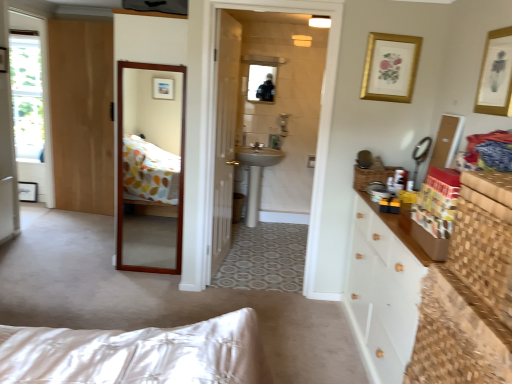
Locate an element on the screen. unoccupied area in front of light brown wood door at left, which is counted as the 2th door, starting from the right is located at coordinates (69, 226).